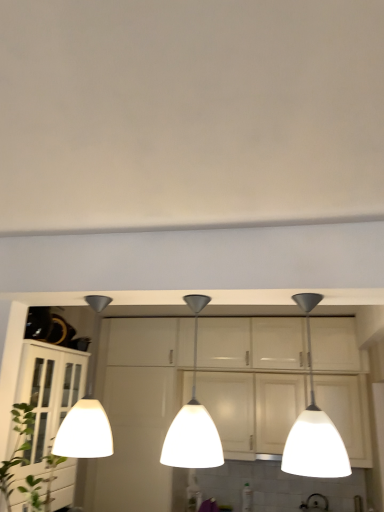
Find the location of a particular element. The image size is (384, 512). blank space situated above white glossy lampshade at right, positioned as the 3th lamp in left-to-right order (from a real-world perspective) is located at coordinates (310, 297).